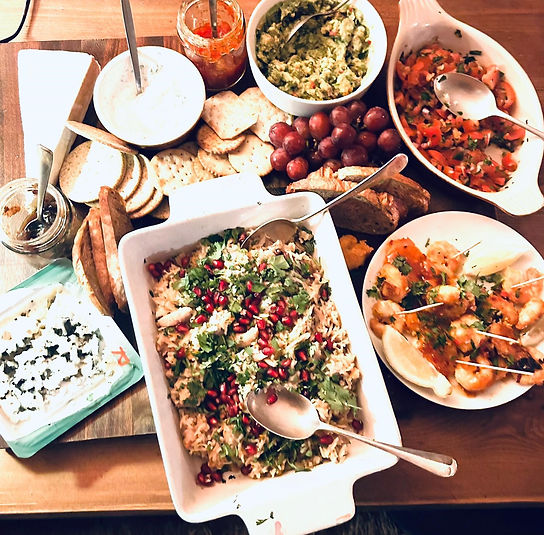
At what (x,y) coordinates should I click in order to perform the action: click on glass jars. Please return your answer as a coordinate pair (x, y). The width and height of the screenshot is (544, 535). Looking at the image, I should click on (61, 226), (221, 68).